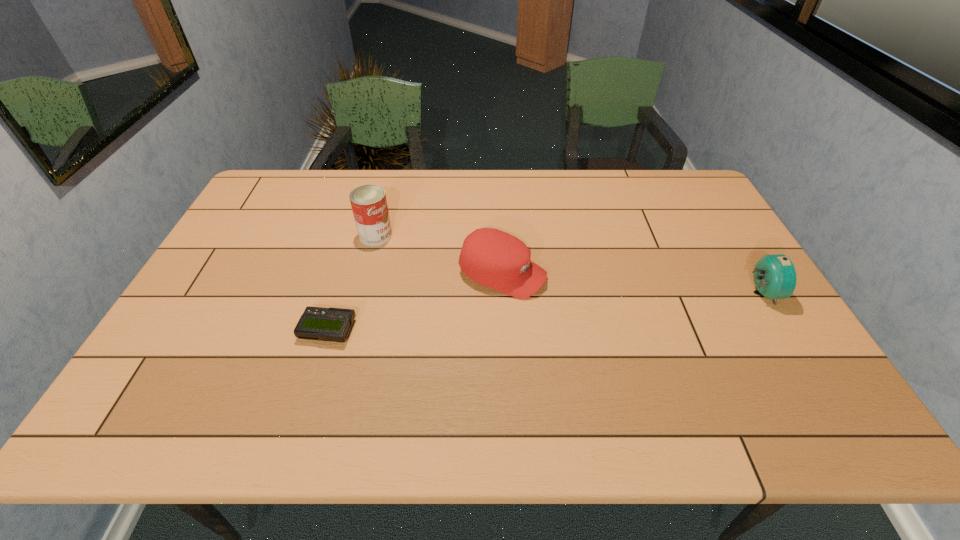
Point out which object is positioned as the second nearest to the tallest object. Please provide its 2D coordinates. Your answer should be formatted as a tuple, i.e. [(x, y)], where the tuple contains the x and y coordinates of a point satisfying the conditions above.

[(330, 324)]

I want to click on blank area in the image that satisfies the following two spatial constraints: 1. on the back side of the can; 2. on the right side of the shortest object, so click(356, 235).

You are a GUI agent. You are given a task and a screenshot of the screen. Output one action in this format:
    pyautogui.click(x=<x>, y=<y>)
    Task: Click on the free space that satisfies the following two spatial constraints: 1. on the back side of the cap; 2. on the right side of the beeper
    Image resolution: width=960 pixels, height=540 pixels.
    Given the screenshot: What is the action you would take?
    pyautogui.click(x=345, y=274)

Find the location of `free spot that satisfies the following two spatial constraints: 1. on the back side of the rightmost object; 2. on the front-facing side of the nearest object`. free spot that satisfies the following two spatial constraints: 1. on the back side of the rightmost object; 2. on the front-facing side of the nearest object is located at coordinates (339, 293).

You are a GUI agent. You are given a task and a screenshot of the screen. Output one action in this format:
    pyautogui.click(x=<x>, y=<y>)
    Task: Click on the blank space that satisfies the following two spatial constraints: 1. on the front side of the second object from right to left; 2. on the right side of the farthest object
    The height and width of the screenshot is (540, 960).
    Given the screenshot: What is the action you would take?
    pyautogui.click(x=366, y=274)

You are a GUI agent. You are given a task and a screenshot of the screen. Output one action in this format:
    pyautogui.click(x=<x>, y=<y>)
    Task: Click on the free space that satisfies the following two spatial constraints: 1. on the back side of the alarm clock; 2. on the front-facing side of the nearest object
    
    Given the screenshot: What is the action you would take?
    pyautogui.click(x=339, y=293)

Locate an element on the screen. The image size is (960, 540). free region that satisfies the following two spatial constraints: 1. on the back side of the shortest object; 2. on the right side of the third object from left to right is located at coordinates (345, 274).